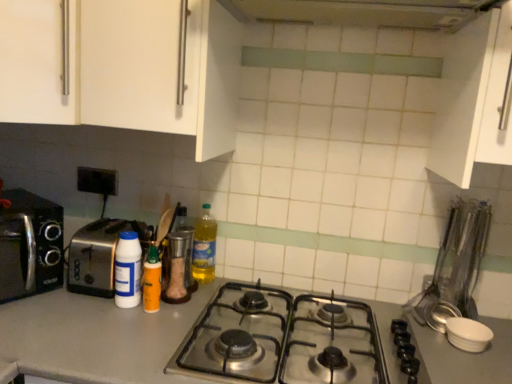
Locate an element on the screen. This screenshot has width=512, height=384. free space in front of metallic silver canister at center, marked as the second bottle in a right-to-left arrangement is located at coordinates (163, 309).